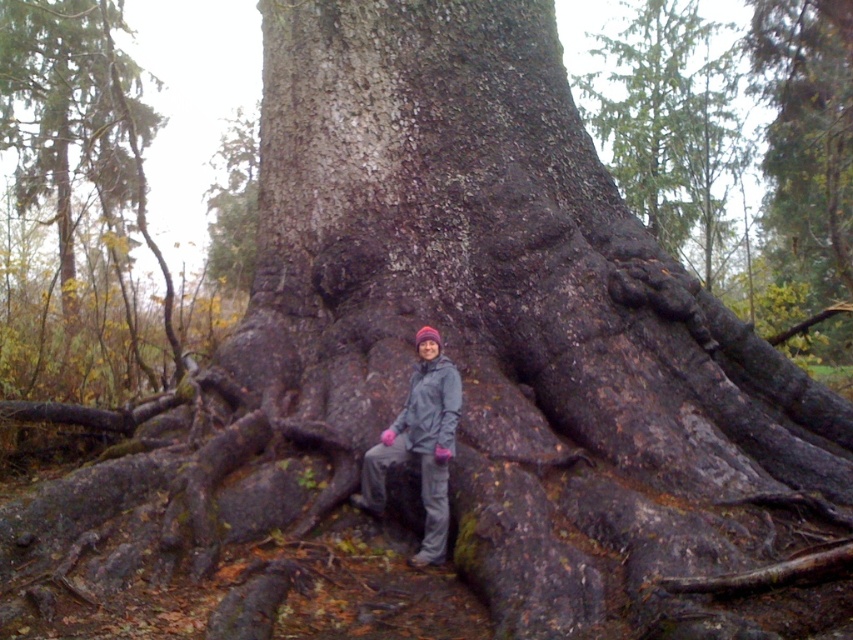
You are a hiker who wants to climb the ancient tree. You see the dark brown bark at center and the dark brown bark at upper center. Which part of the tree should you grab to reach higher up?

You should grab the dark brown bark at upper center because it is taller than the dark brown bark at center.

You are a hiker who wants to take a photo of the dark brown bark at upper center but need to avoid blocking the gray fabric jacket at center in the shot. Which object should you move closer to?

You should move closer to the dark brown bark at upper center because it is closer to you than the gray fabric jacket at center, so moving towards it would allow you to frame the shot without the jacket obstructing the bark.